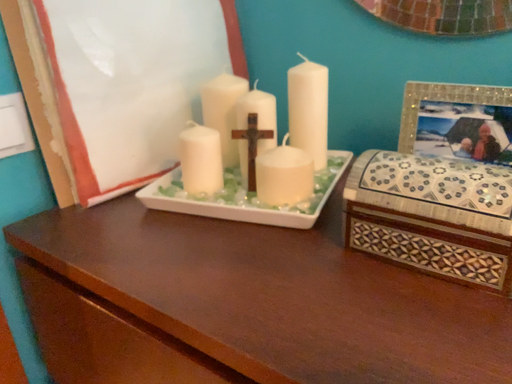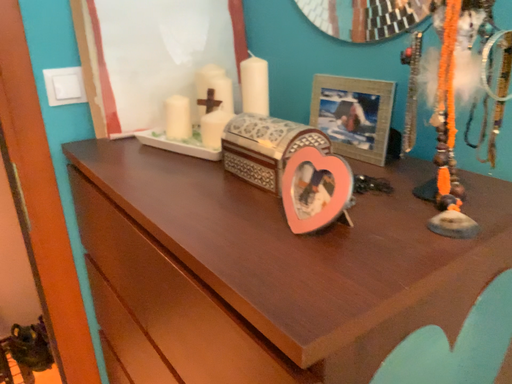
Question: How did the camera likely rotate when shooting the video?

Choices:
 (A) rotated left
 (B) rotated right

Answer: (A)